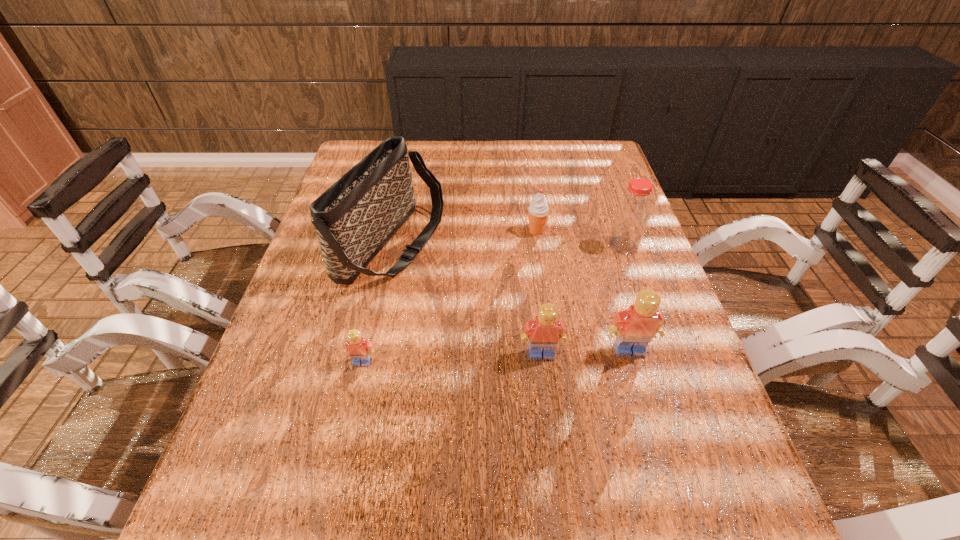
Where is `location for an additional Lego to make spacing equal`? This screenshot has width=960, height=540. location for an additional Lego to make spacing equal is located at coordinates (452, 358).